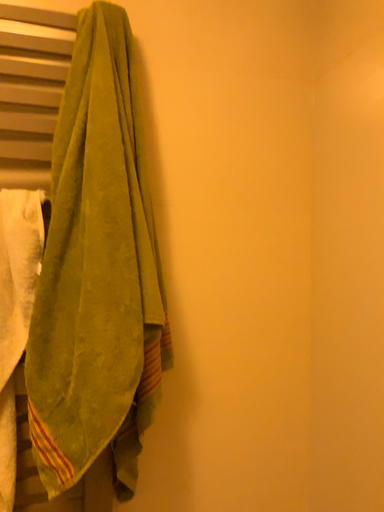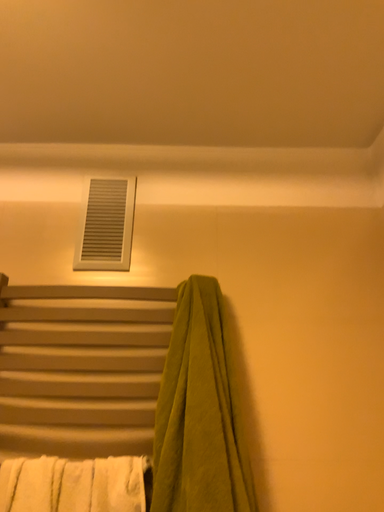
Question: Which way did the camera rotate in the video?

Choices:
 (A) rotated left
 (B) rotated right

Answer: (A)